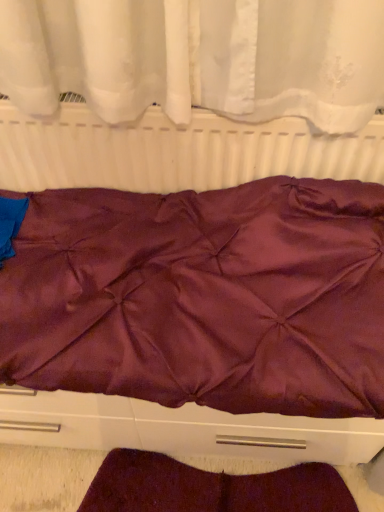
Question: Is satin purple bedspread at center wider or thinner than burgundy satin blanket at lower center?

Choices:
 (A) wide
 (B) thin

Answer: (A)

Question: From the image's perspective, is satin purple bedspread at center positioned above or below burgundy satin blanket at lower center?

Choices:
 (A) below
 (B) above

Answer: (B)

Question: Which object is the farthest from the matte white radiator at center?

Choices:
 (A) satin purple bedspread at center
 (B) burgundy satin blanket at lower center

Answer: (B)

Question: Which object is the closest to the satin purple bedspread at center?

Choices:
 (A) burgundy satin blanket at lower center
 (B) matte white radiator at center

Answer: (B)